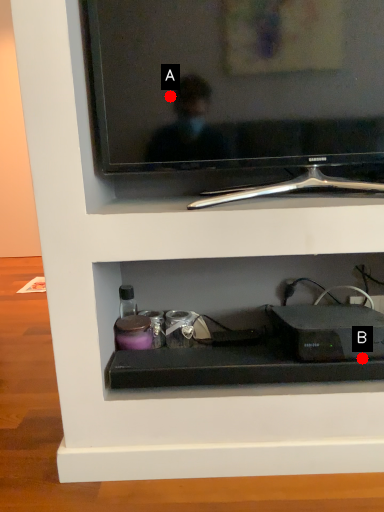
Question: Two points are circled on the image, labeled by A and B beside each circle. Which of the following is the farthest from the observer?

Choices:
 (A) A is further
 (B) B is further

Answer: (B)